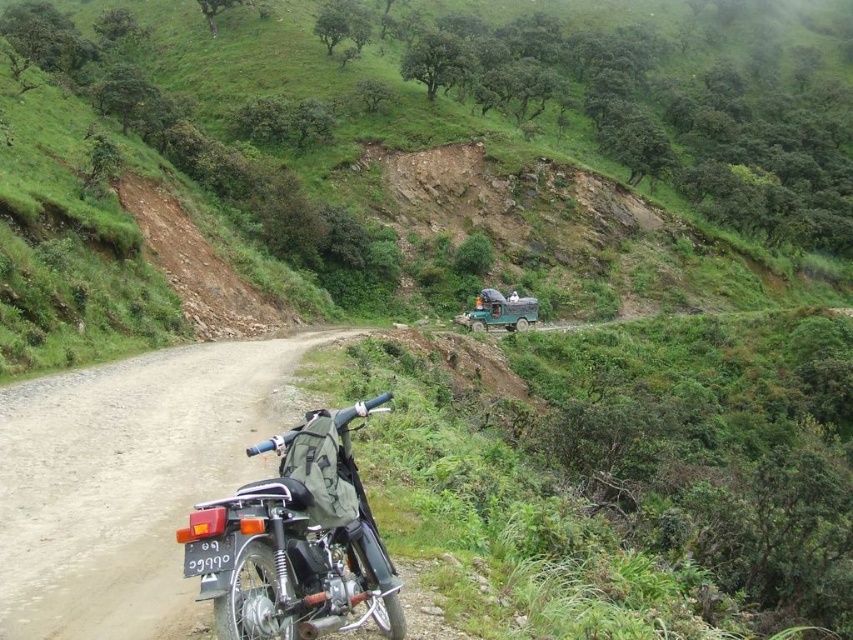
Question: Which of the following is the closest to the observer?

Choices:
 (A) shiny black motorcycle at center
 (B) dirt/gravel road at lower left

Answer: (A)

Question: Is the position of shiny black motorcycle at center less distant than that of green matte truck at center?

Choices:
 (A) yes
 (B) no

Answer: (A)

Question: Which point is farther from the camera taking this photo?

Choices:
 (A) (289, 355)
 (B) (488, 305)

Answer: (B)

Question: Can you confirm if dirt/gravel road at lower left is positioned above shiny black motorcycle at center?

Choices:
 (A) yes
 (B) no

Answer: (B)

Question: Among these objects, which one is farthest from the camera?

Choices:
 (A) green matte truck at center
 (B) dirt/gravel road at lower left
 (C) shiny black motorcycle at center

Answer: (A)

Question: Where is dirt/gravel road at lower left located in relation to green matte truck at center in the image?

Choices:
 (A) right
 (B) left

Answer: (B)